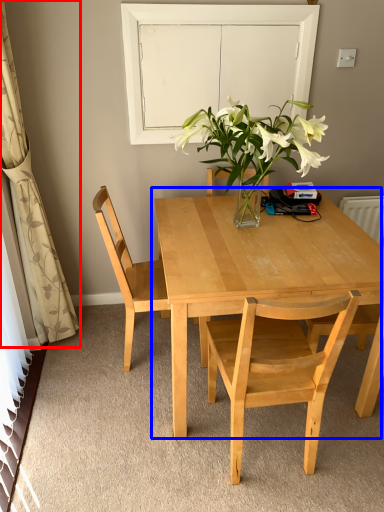
Question: Which object is closer to the camera taking this photo, curtain (highlighted by a red box) or kitchen & dining room table (highlighted by a blue box)?

Choices:
 (A) curtain
 (B) kitchen & dining room table

Answer: (A)